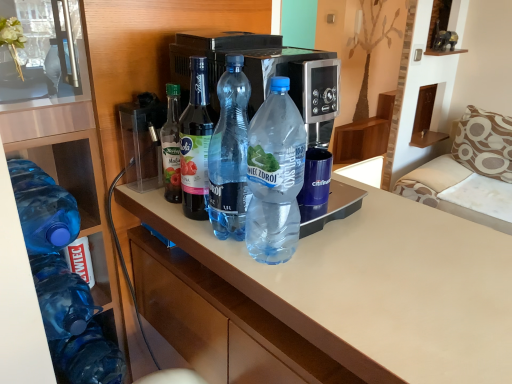
Locate an element on the screen. Image resolution: width=512 pixels, height=384 pixels. empty space that is to the right of transparent plastic bottle at center, the second bottle when ordered from right to left is located at coordinates (340, 249).